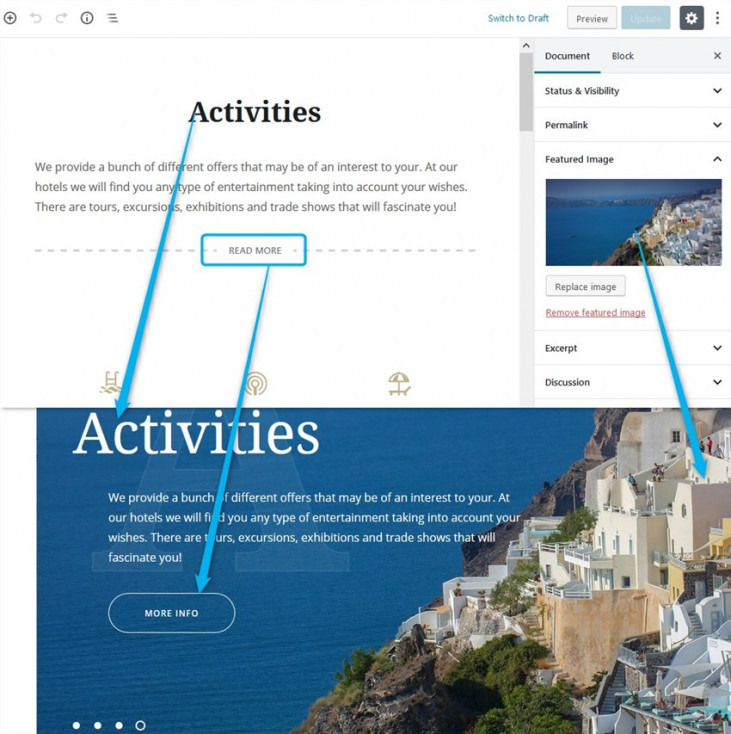
You are a GUI agent. You are given a task and a screenshot of the screen. Output one action in this format:
    pyautogui.click(x=<x>, y=<y>)
    Task: Click on the handrails
    This screenshot has width=731, height=734.
    Given the screenshot: What is the action you would take?
    pyautogui.click(x=575, y=592), pyautogui.click(x=556, y=592), pyautogui.click(x=577, y=556), pyautogui.click(x=548, y=547), pyautogui.click(x=677, y=563), pyautogui.click(x=716, y=531), pyautogui.click(x=628, y=654), pyautogui.click(x=621, y=509)